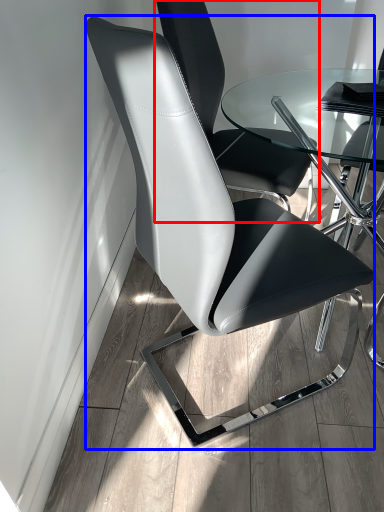
Question: Which object appears closest to the camera in this image, chair (highlighted by a red box) or chair (highlighted by a blue box)?

Choices:
 (A) chair
 (B) chair

Answer: (B)